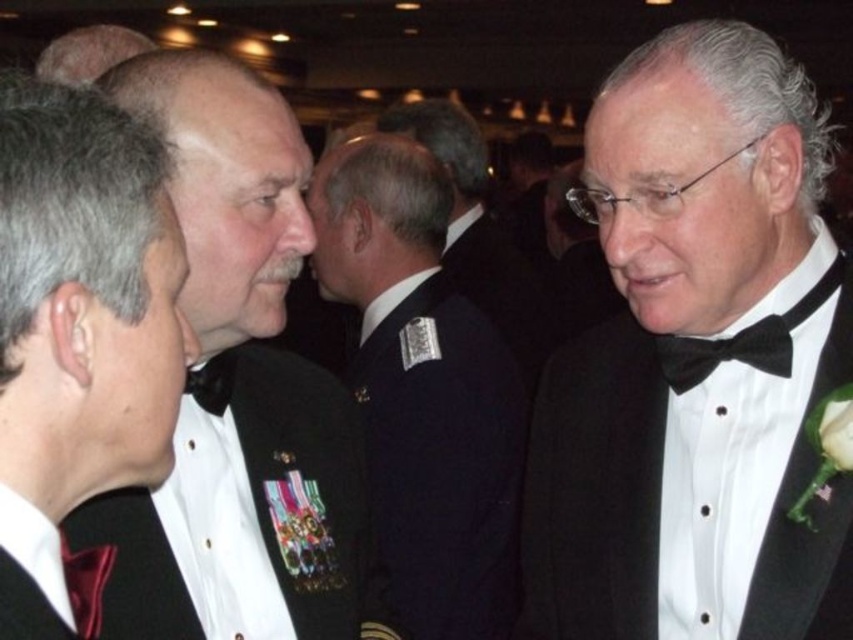
Based on the photo, can you confirm if navy blue fabric at center is bigger than matte black bow tie at center?

Yes, navy blue fabric at center is bigger than matte black bow tie at center.

Does navy blue fabric at center appear over matte black bow tie at center?

Incorrect, navy blue fabric at center is not positioned above matte black bow tie at center.

Where is `navy blue fabric at center`? navy blue fabric at center is located at coordinates (440, 460).

Identify the location of navy blue fabric at center. The image size is (853, 640). (440, 460).

Who is higher up, black satin tuxedo at right or black satin bow tie at right?

black satin bow tie at right

Which is below, black satin tuxedo at right or black satin bow tie at right?

black satin tuxedo at right is below.

Is point (693, 257) positioned after point (689, 339)?

No.

Locate an element on the screen. This screenshot has width=853, height=640. black satin tuxedo at right is located at coordinates click(x=695, y=362).

Does shiny black fabric at center have a lesser width compared to matte black bow tie at center?

Incorrect, shiny black fabric at center's width is not less than matte black bow tie at center's.

Is point (328, 627) positioned before point (213, 358)?

No, it is behind (213, 358).

Find the location of a particular element. shiny black fabric at center is located at coordinates (244, 516).